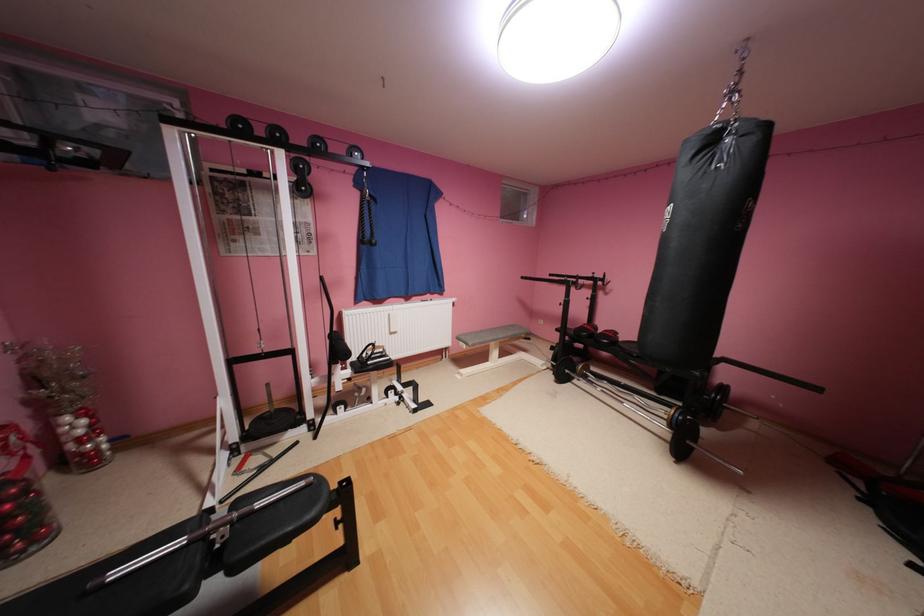
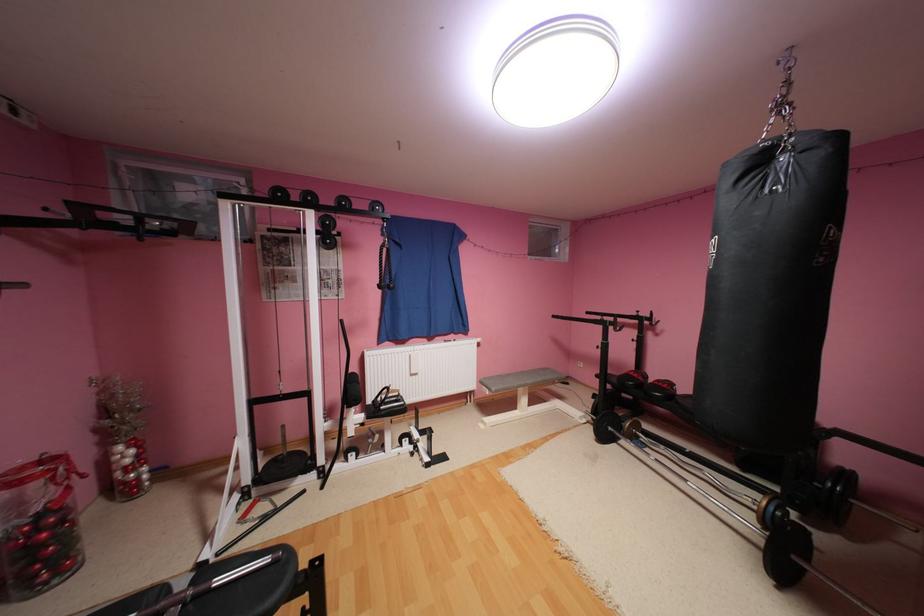
Locate, in the second image, the point that corresponds to point (580, 333) in the first image.

(624, 379)